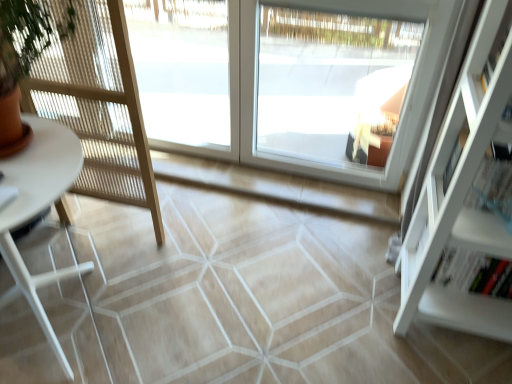
Find the location of a particular element. The height and width of the screenshot is (384, 512). vacant space that's between white glossy table at left and white matte shelf at right is located at coordinates (260, 317).